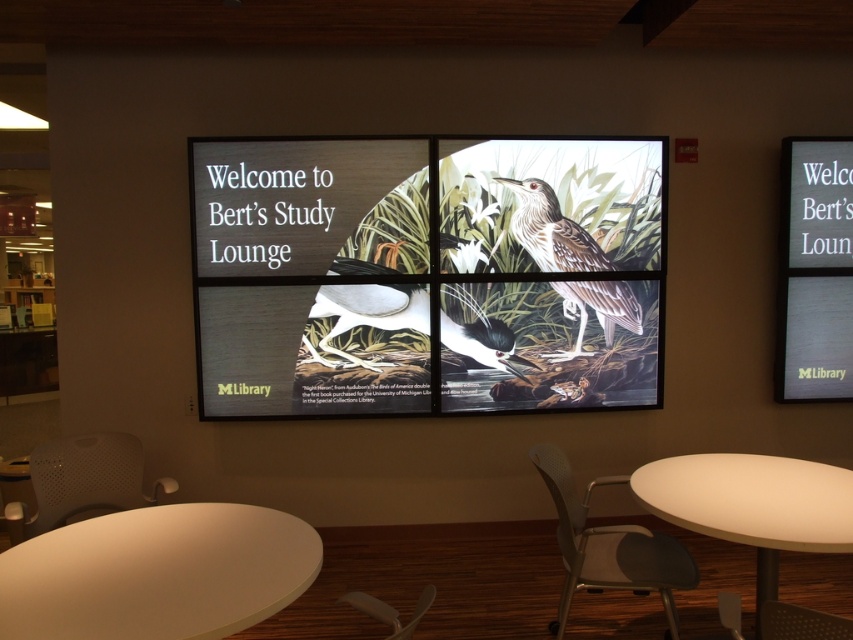
Question: Which object is the closest to the white glossy bird at center?

Choices:
 (A) gray plastic chair at lower center
 (B) matte wooden signboard at center
 (C) silver metallic sign at upper right
 (D) white paper bird at center

Answer: (B)

Question: Does silver metallic sign at upper right have a smaller size compared to metallic gray chair at lower right?

Choices:
 (A) yes
 (B) no

Answer: (B)

Question: Which point is farther to the camera?

Choices:
 (A) white plastic chair at lower center
 (B) white paper bird at center
 (C) white glossy bird at center

Answer: (B)

Question: Does white matte table at lower right appear under white glossy bird at center?

Choices:
 (A) no
 (B) yes

Answer: (B)

Question: Is white matte table at lower left positioned before white glossy bird at center?

Choices:
 (A) yes
 (B) no

Answer: (A)

Question: Among these points, which one is farthest from the camera?

Choices:
 (A) (370, 404)
 (B) (838, 376)
 (C) (383, 608)
 (D) (666, 506)

Answer: (B)